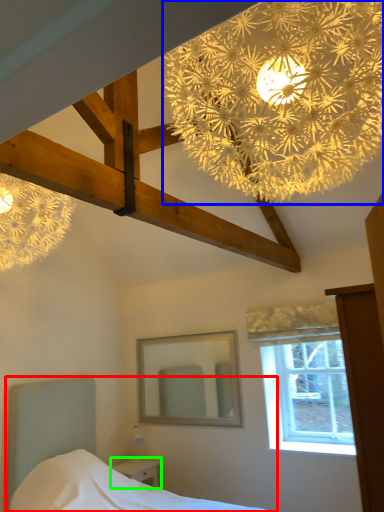
Question: Considering the real-world distances, which object is farthest from bed (highlighted by a red box)? flower (highlighted by a blue box) or nightstand (highlighted by a green box)?

Choices:
 (A) flower
 (B) nightstand

Answer: (A)